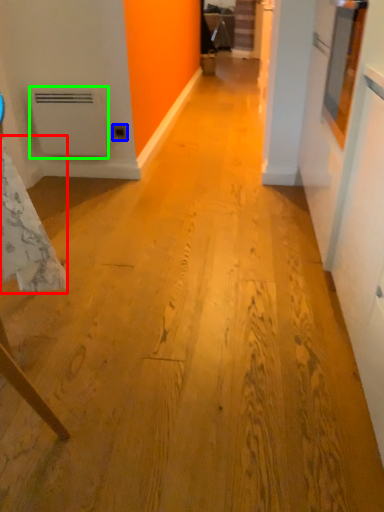
Question: Estimate the real-world distances between objects in this image. Which object is closer to tablecloth (highlighted by a red box), electric outlet (highlighted by a blue box) or water heater (highlighted by a green box)?

Choices:
 (A) electric outlet
 (B) water heater

Answer: (B)